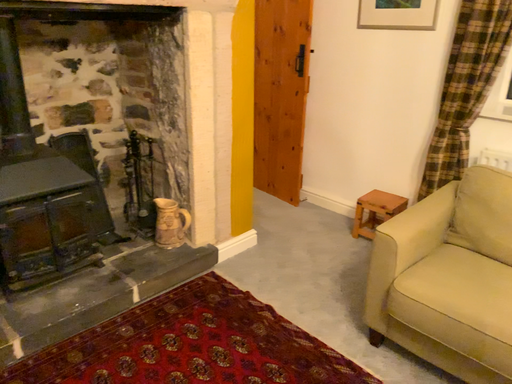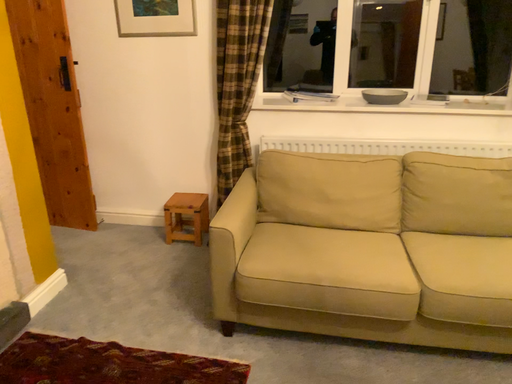
Question: How did the camera likely rotate when shooting the video?

Choices:
 (A) rotated left
 (B) rotated right

Answer: (B)